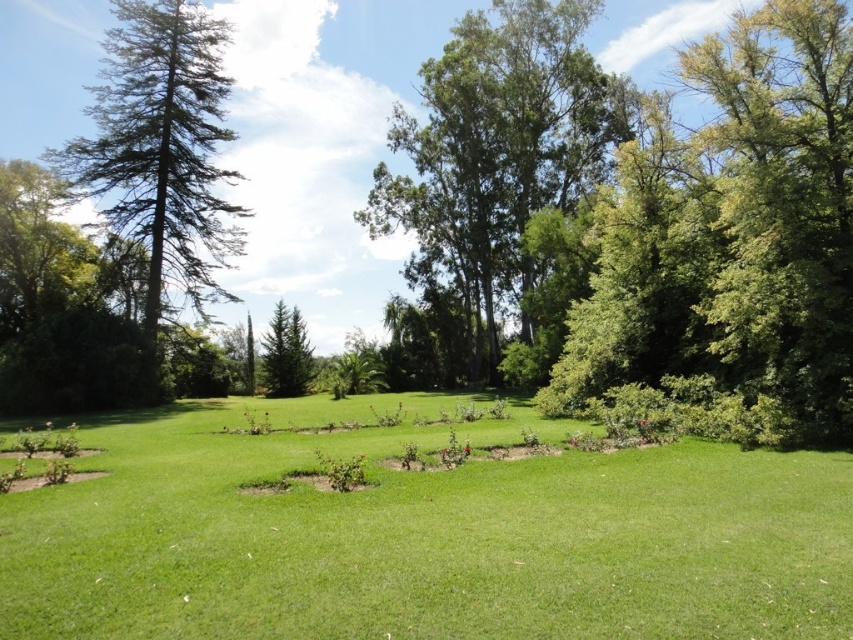
Can you confirm if green grassy at center is taller than green needle-like at left?

Incorrect, green grassy at center's height is not larger of green needle-like at left's.

Can you confirm if green grassy at center is positioned to the left of green needle-like at left?

No, green grassy at center is not to the left of green needle-like at left.

The height and width of the screenshot is (640, 853). What do you see at coordinates (425, 540) in the screenshot?
I see `green grassy at center` at bounding box center [425, 540].

Image resolution: width=853 pixels, height=640 pixels. Identify the location of green grassy at center. (425, 540).

Is green leafy tree at right shorter than green needle-like at left?

Correct, green leafy tree at right is not as tall as green needle-like at left.

Can you confirm if green leafy tree at right is positioned above green needle-like at left?

No, green leafy tree at right is not above green needle-like at left.

The width and height of the screenshot is (853, 640). What are the coordinates of `green leafy tree at right` in the screenshot? It's located at (733, 230).

Between green grassy at center and green leafy tree at right, which one appears on the left side from the viewer's perspective?

From the viewer's perspective, green grassy at center appears more on the left side.

What do you see at coordinates (425, 540) in the screenshot? I see `green grassy at center` at bounding box center [425, 540].

Which is behind, point (428, 576) or point (746, 129)?

Positioned behind is point (746, 129).

Identify the location of green grassy at center. (425, 540).